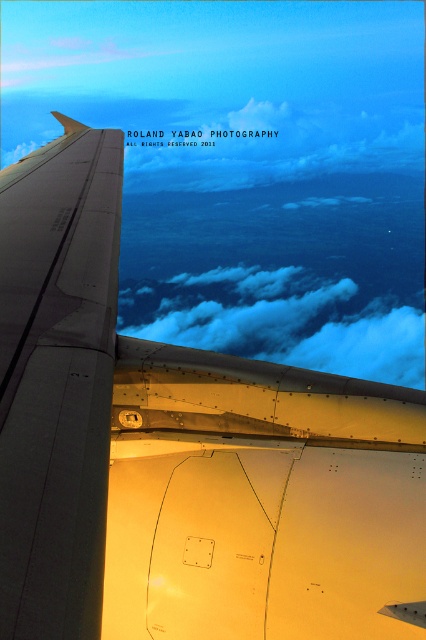
Question: Which of the following is the closest to the observer?

Choices:
 (A) (81, 157)
 (B) (383, 342)

Answer: (A)

Question: Among these objects, which one is nearest to the camera?

Choices:
 (A) matte gray wing at left
 (B) cloudy sky at upper center

Answer: (A)

Question: Is matte gray wing at left wider than cloudy sky at upper center?

Choices:
 (A) no
 (B) yes

Answer: (A)

Question: Is matte gray wing at left thinner than cloudy sky at upper center?

Choices:
 (A) yes
 (B) no

Answer: (A)

Question: Is matte gray wing at left smaller than cloudy sky at upper center?

Choices:
 (A) yes
 (B) no

Answer: (A)